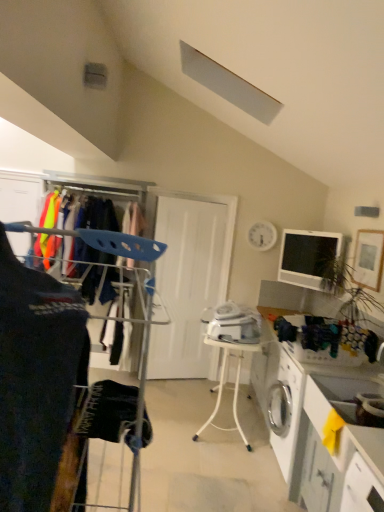
Question: Are matte black monitor at upper right and white plastic table at center far apart?

Choices:
 (A) no
 (B) yes

Answer: (B)

Question: Is matte black monitor at upper right positioned behind white plastic table at center?

Choices:
 (A) yes
 (B) no

Answer: (A)

Question: Can you see matte black monitor at upper right touching white plastic table at center?

Choices:
 (A) no
 (B) yes

Answer: (A)

Question: Is matte black monitor at upper right outside of white plastic table at center?

Choices:
 (A) no
 (B) yes

Answer: (B)

Question: Can you confirm if matte black monitor at upper right is smaller than white plastic table at center?

Choices:
 (A) yes
 (B) no

Answer: (A)

Question: Is point (302, 496) positioned closer to the camera than point (196, 434)?

Choices:
 (A) closer
 (B) farther

Answer: (A)

Question: Based on their positions, is white glossy counter at lower right, the 2th counter in the back-to-front sequence, located to the left or right of white plastic table at center?

Choices:
 (A) right
 (B) left

Answer: (A)

Question: Do you think white glossy counter at lower right, the 1th counter viewed from the front, is within white plastic table at center, or outside of it?

Choices:
 (A) outside
 (B) inside

Answer: (A)

Question: Is white glossy counter at lower right, the 2th counter in the back-to-front sequence, in front of or behind white plastic table at center in the image?

Choices:
 (A) behind
 (B) front

Answer: (B)

Question: Looking at their shapes, would you say white glossy counter at lower right, the 1th counter viewed from the front, is wider or thinner than white matte door at center?

Choices:
 (A) wide
 (B) thin

Answer: (A)

Question: Is point (334, 501) positioned closer to the camera than point (226, 212)?

Choices:
 (A) farther
 (B) closer

Answer: (B)

Question: From a real-world perspective, is white glossy counter at lower right, the 2th counter in the back-to-front sequence, physically located above or below white matte door at center?

Choices:
 (A) above
 (B) below

Answer: (B)

Question: From the image's perspective, is white glossy counter at lower right, the 2th counter in the back-to-front sequence, located above or below white matte door at center?

Choices:
 (A) above
 (B) below

Answer: (B)

Question: Is dark blue fabric at left to the left or to the right of white plastic iron at center in the image?

Choices:
 (A) right
 (B) left

Answer: (B)

Question: Is dark blue fabric at left bigger or smaller than white plastic iron at center?

Choices:
 (A) small
 (B) big

Answer: (B)